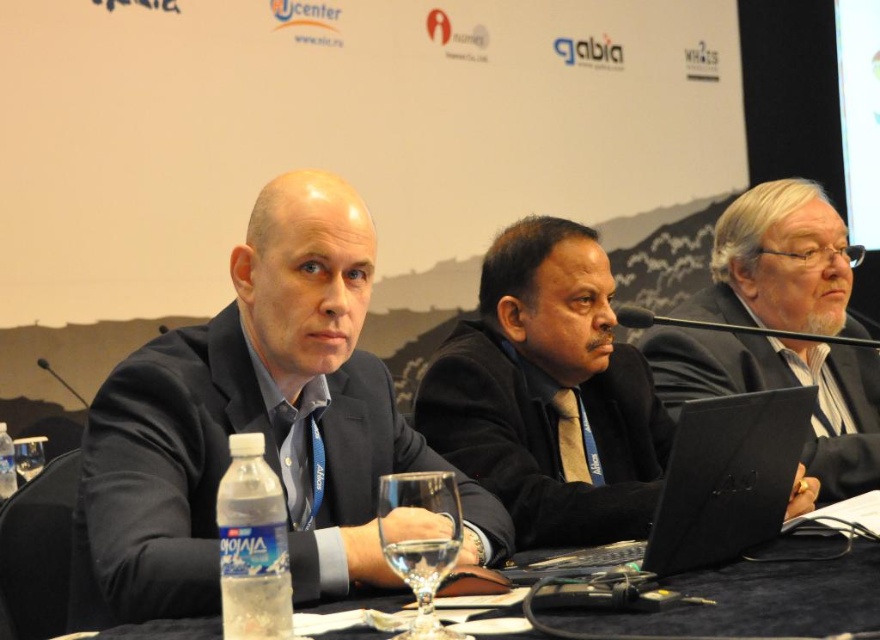
Between black glossy suit at center and black matte suit at center, which one is positioned higher?

black glossy suit at center is higher up.

Which is behind, point (569, 298) or point (605, 477)?

Point (605, 477)

Where is `black glossy suit at center`? The image size is (880, 640). black glossy suit at center is located at coordinates (548, 392).

Is black glossy suit at center to the left of gray matte suit at right from the viewer's perspective?

Indeed, black glossy suit at center is positioned on the left side of gray matte suit at right.

Who is more distant from viewer, (x=533, y=376) or (x=723, y=308)?

The point (x=723, y=308) is behind.

Identify the location of black glossy suit at center. This screenshot has height=640, width=880. (548, 392).

Consider the image. Which is below, gray matte suit at right or clear plastic water bottle at center?

clear plastic water bottle at center is lower down.

Is the position of gray matte suit at right less distant than that of clear plastic water bottle at center?

No, gray matte suit at right is further to the viewer.

Is point (766, 308) positioned before point (860, 508)?

That is False.

Locate an element on the screen. The width and height of the screenshot is (880, 640). gray matte suit at right is located at coordinates (782, 387).